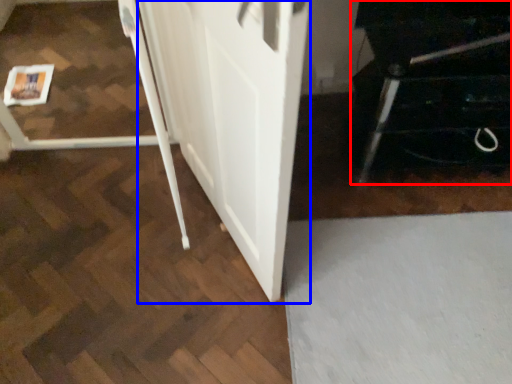
Question: Which object is closer to the camera taking this photo, furniture (highlighted by a red box) or barn door (highlighted by a blue box)?

Choices:
 (A) furniture
 (B) barn door

Answer: (B)